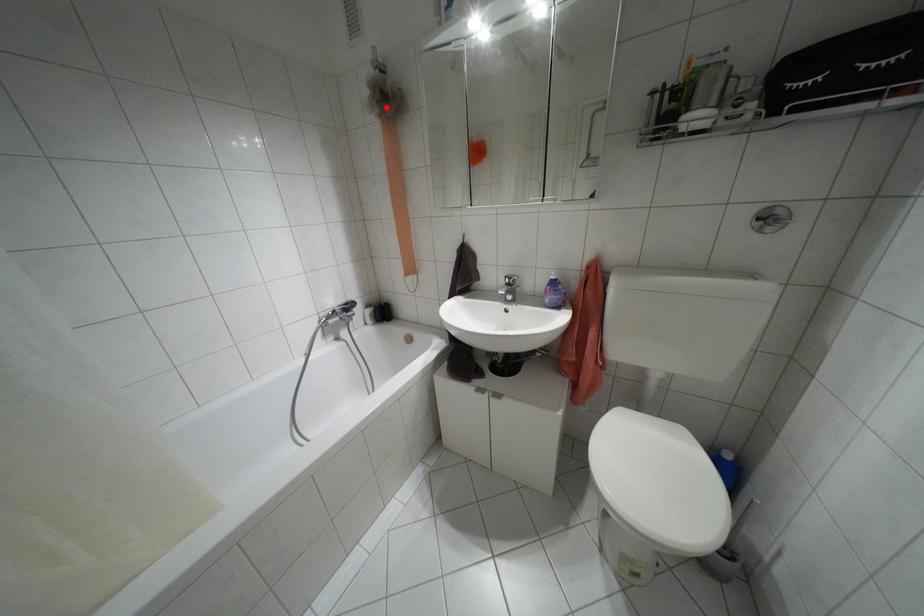
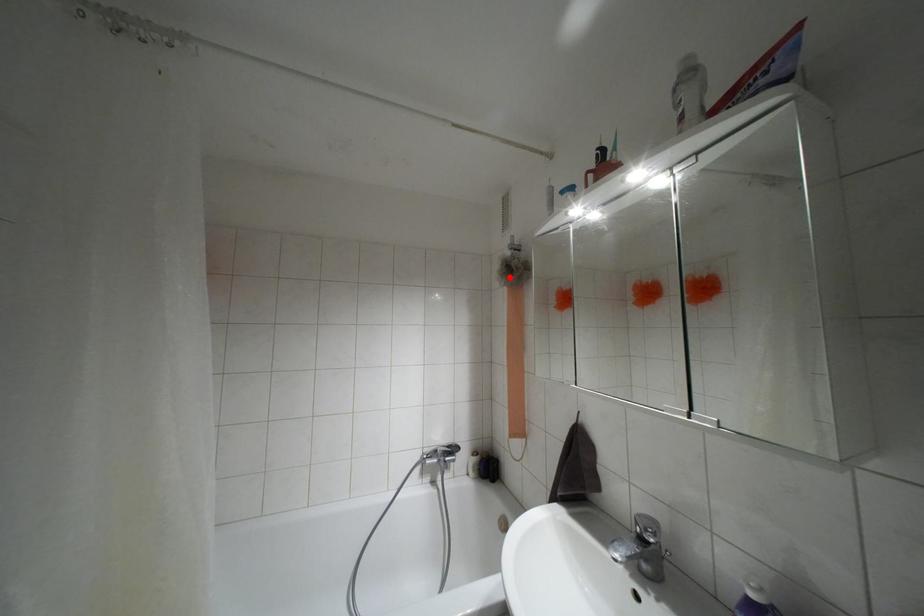
I am providing you with two images of the same scene from different viewpoints. A red point is marked on the first image and another point is marked on the second image. Is the red point in image1 aligned with the point shown in image2?

Yes